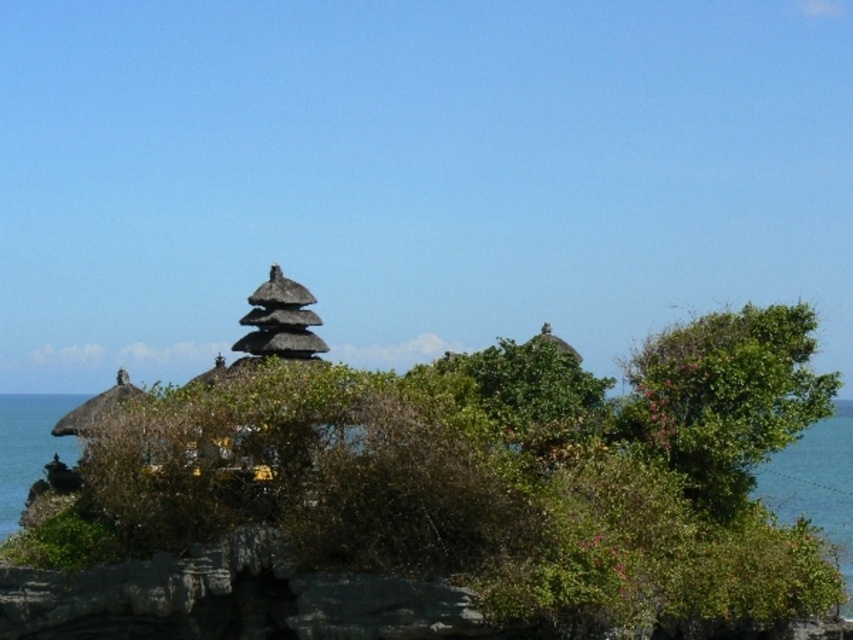
Does green leafy bush at right have a greater height compared to blue water at lower right?

No.

Where is `green leafy bush at right`? Image resolution: width=853 pixels, height=640 pixels. green leafy bush at right is located at coordinates (724, 397).

Between point (618, 435) and point (822, 442), which one is positioned behind?

The point (822, 442) is more distant.

Find the location of a particular element. This screenshot has height=640, width=853. green leafy bush at right is located at coordinates (724, 397).